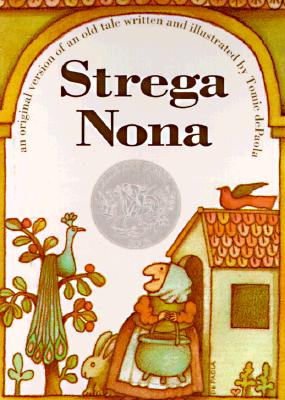
Image resolution: width=285 pixels, height=400 pixels. What are the coordinates of `book` in the screenshot? It's located at (158, 259).